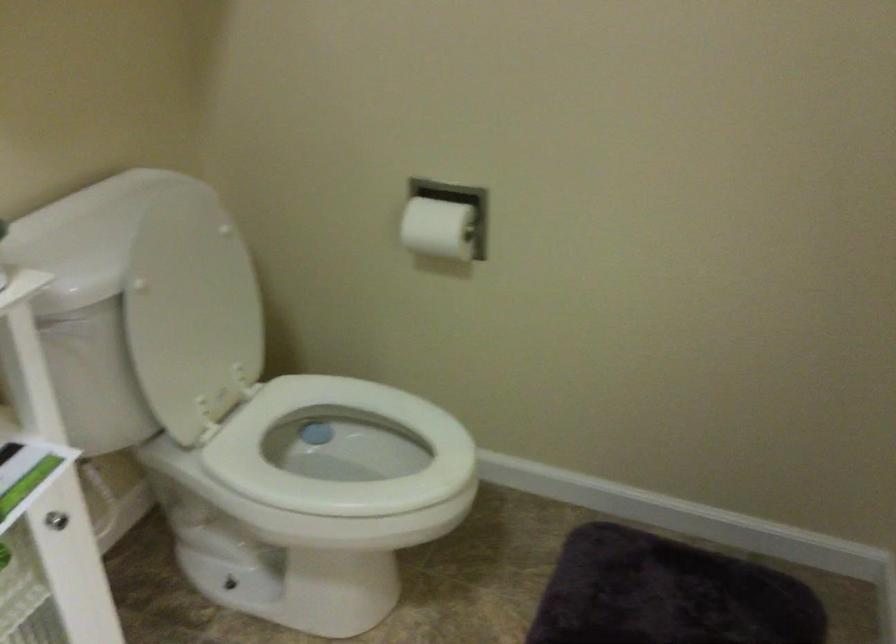
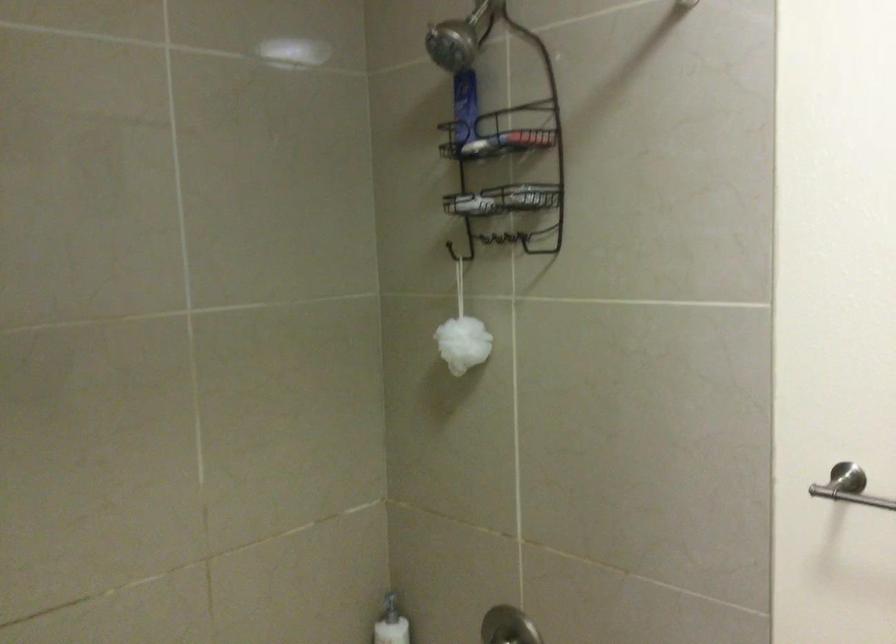
How did the camera likely rotate?

The camera rotated toward left-down.